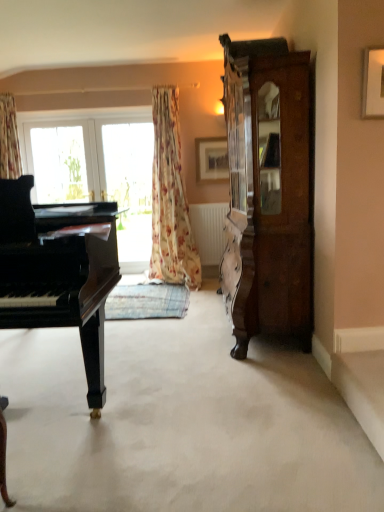
The height and width of the screenshot is (512, 384). What are the coordinates of `free location in front of dark brown wood cabinet at right` in the screenshot? It's located at (230, 387).